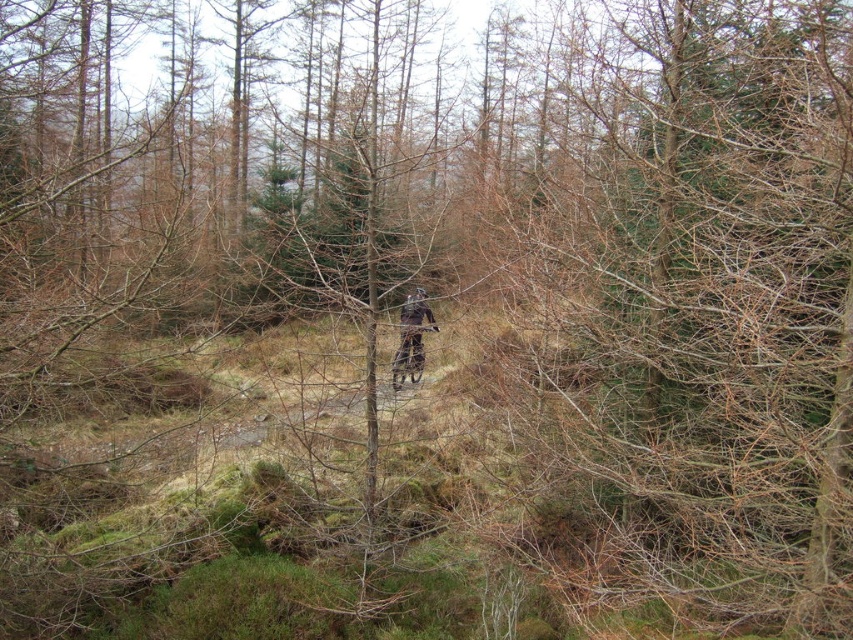
Question: Which object appears closest to the camera in this image?

Choices:
 (A) dark brown leather jacket at center
 (B) shiny metallic mountain bike at center

Answer: (A)

Question: Among these objects, which one is nearest to the camera?

Choices:
 (A) shiny metallic mountain bike at center
 (B) dark brown leather jacket at center

Answer: (B)

Question: Is dark brown leather jacket at center to the right of shiny metallic mountain bike at center from the viewer's perspective?

Choices:
 (A) no
 (B) yes

Answer: (B)

Question: Does dark brown leather jacket at center have a greater width compared to shiny metallic mountain bike at center?

Choices:
 (A) yes
 (B) no

Answer: (B)

Question: Is dark brown leather jacket at center smaller than shiny metallic mountain bike at center?

Choices:
 (A) yes
 (B) no

Answer: (A)